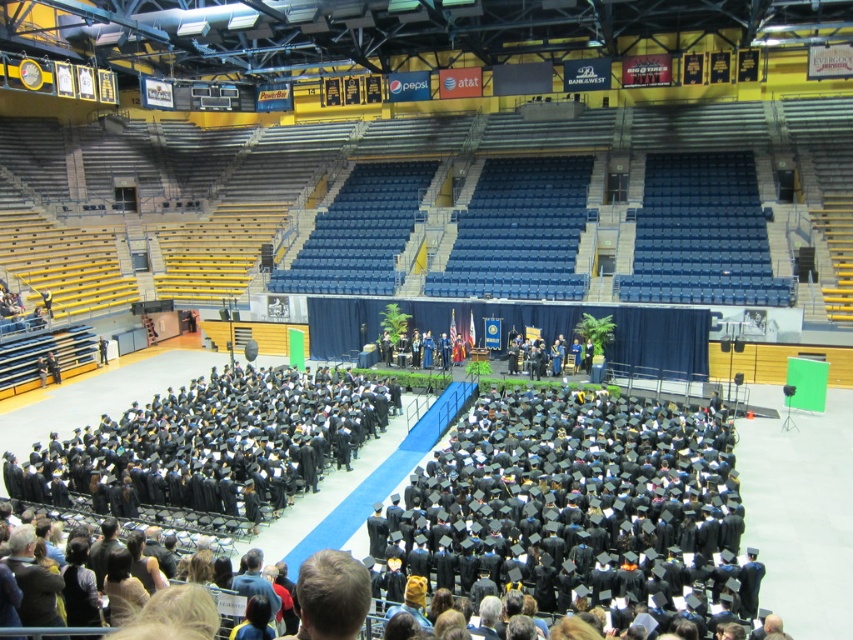
You are a photographer positioned at the back of the arena. You need to capture a photo of all the graduates wearing black matte graduation gowns at center and black matte graduation gowns at lower left. Based on their positions, which group of graduates will appear taller in the photo?

The black matte graduation gowns at lower left will appear taller in the photo because they have a greater height compared to the black matte graduation gowns at center.

Based on the photo, you are a photographer at the graduation ceremony. You need to capture a photo that includes both the black matte graduation gowns at center and the black matte graduation gowns at lower left. Considering their sizes, which group of gowns should you focus on to ensure they are both clearly visible in the frame?

The black matte graduation gowns at center are larger in width than the black matte graduation gowns at lower left. To ensure both groups are clearly visible, focus on the larger group at center so that the smaller group at lower left can fit into the frame without being too small.

You are a photographer standing at the entrance of the arena. You want to take a photo of the black matte graduation gowns at center from a position that ensures they are the main focus. Based on their current position, where should you position yourself to capture them clearly?

To ensure the black matte graduation gowns at center are the main focus, position yourself directly in front of them, aligned with their central point at coordinates approximately 0.803 on the x and 0.679 on the y axis. This placement will allow the gowns to be centered and prominent in the frame.